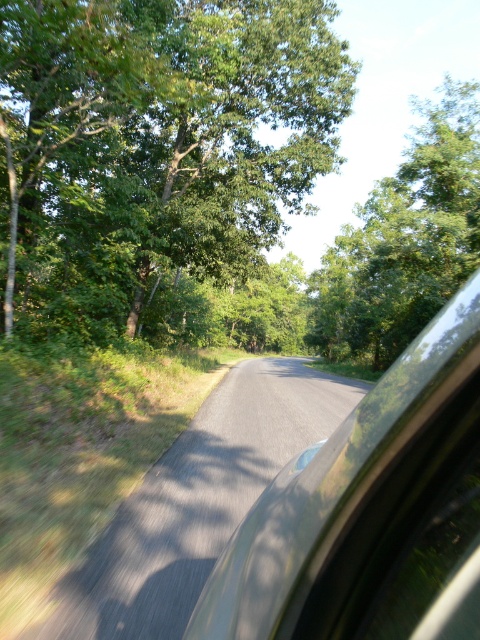
You are a passenger in the metallic silver car at center. You notice the green leafy tree at upper right outside the window. From your perspective inside the car, which object takes up more visual space in the window frame?

The green leafy tree at upper right takes up more visual space than the metallic silver car at center in the window frame.

You are a passenger in the car and notice two points marked on the window. The first point is at coordinates point (110, 67) and the second is at point (348, 612). Which point is closer to your face?

Point (110, 67) is closer to your face because it is further to the viewer than point (348, 612).

You are a passenger in the metallic silver car at center. You notice a green leafy tree at upper right outside the window. From your perspective inside the car, which side of the tree is the car positioned relative to the tree?

The metallic silver car at center is positioned on the left side of green leafy tree at upper right, so from your perspective inside the car, the car is to the left of the tree.